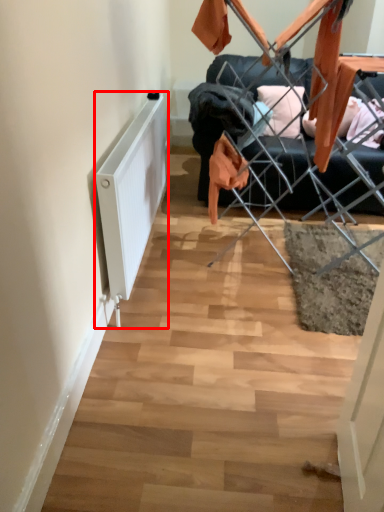
Question: In this image, where is radiator (annotated by the red box) located relative to furniture?

Choices:
 (A) left
 (B) right

Answer: (A)